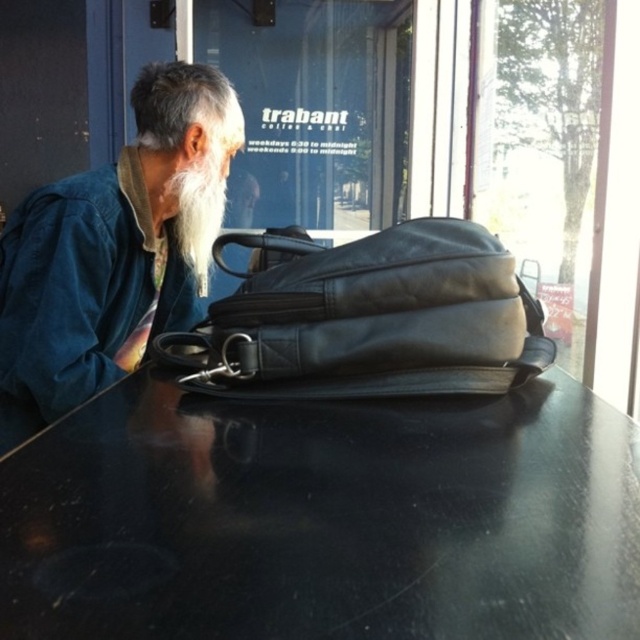
Question: Which point is farther to the camera?

Choices:
 (A) black leather bag at center
 (B) white fuzzy beard at left
 (C) blue denim jacket at left
 (D) black glossy table at center

Answer: (B)

Question: Is black leather bag at center positioned in front of white fuzzy beard at left?

Choices:
 (A) yes
 (B) no

Answer: (A)

Question: Which point is closer to the camera?

Choices:
 (A) black leather bag at center
 (B) white fuzzy beard at left
 (C) black glossy table at center

Answer: (C)

Question: Does black leather bag at center appear on the left side of white fuzzy beard at left?

Choices:
 (A) yes
 (B) no

Answer: (B)

Question: Is black glossy table at center closer to the viewer compared to black leather bag at center?

Choices:
 (A) yes
 (B) no

Answer: (A)

Question: Which of these objects is positioned farthest from the white fuzzy beard at left?

Choices:
 (A) blue denim jacket at left
 (B) black leather bag at center

Answer: (B)